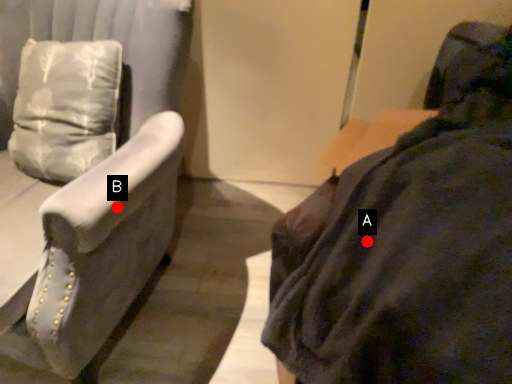
Question: Two points are circled on the image, labeled by A and B beside each circle. Which of the following is the closest to the observer?

Choices:
 (A) A is closer
 (B) B is closer

Answer: (A)